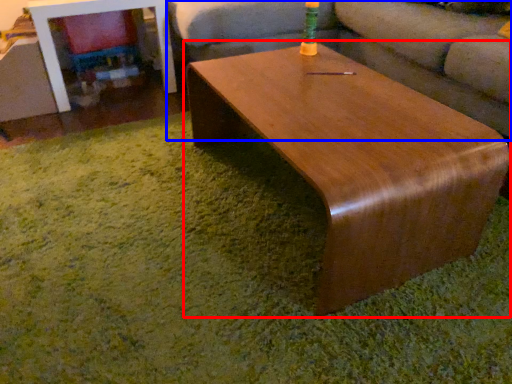
Question: Among these objects, which one is farthest to the camera, coffee table (highlighted by a red box) or studio couch (highlighted by a blue box)?

Choices:
 (A) coffee table
 (B) studio couch

Answer: (B)